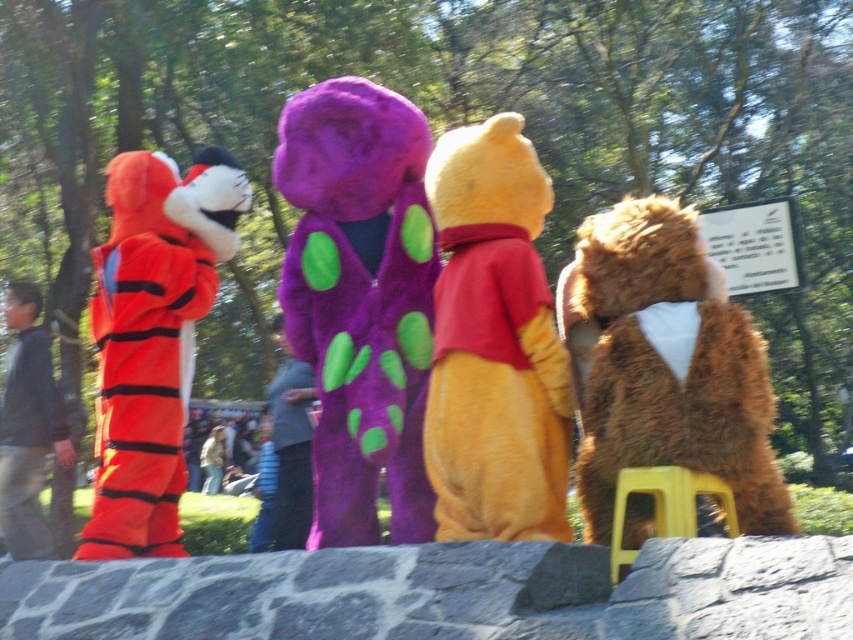
Question: Does purple fuzzy teddy at center appear under dark gray sweater at left?

Choices:
 (A) yes
 (B) no

Answer: (B)

Question: Which point is farther from the camera taking this photo?

Choices:
 (A) (288, 481)
 (B) (494, 468)
 (C) (312, 481)

Answer: (A)

Question: Does fuzzy brown teddy bear at right have a smaller size compared to orange plush teddy bear at left?

Choices:
 (A) no
 (B) yes

Answer: (B)

Question: Does purple fuzzy teddy at center appear under dark gray sweater at left?

Choices:
 (A) no
 (B) yes

Answer: (A)

Question: Which of the following is the closest to the observer?

Choices:
 (A) (621, 524)
 (B) (161, 340)

Answer: (A)

Question: Based on their relative distances, which object is nearer to the yellow plastic stool at lower right?

Choices:
 (A) velvet purple costume at center
 (B) purple fuzzy teddy at center
 (C) fuzzy brown teddy bear at right

Answer: (C)